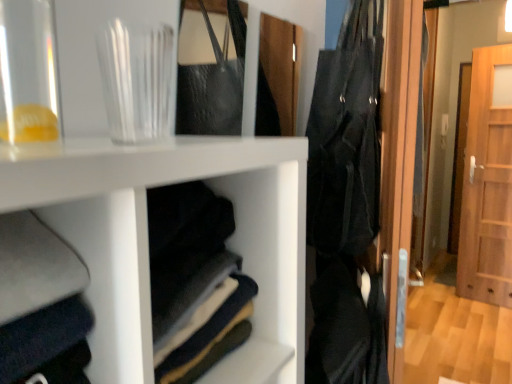
Find the location of a particular element. vacant space positioned to the left of wooden door at right is located at coordinates (452, 303).